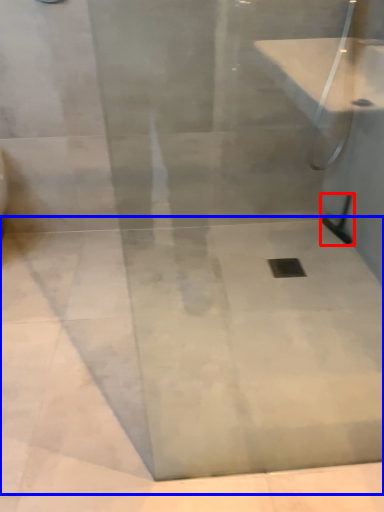
Question: Among these objects, which one is farthest to the camera, shower (highlighted by a red box) or concrete (highlighted by a blue box)?

Choices:
 (A) shower
 (B) concrete

Answer: (A)